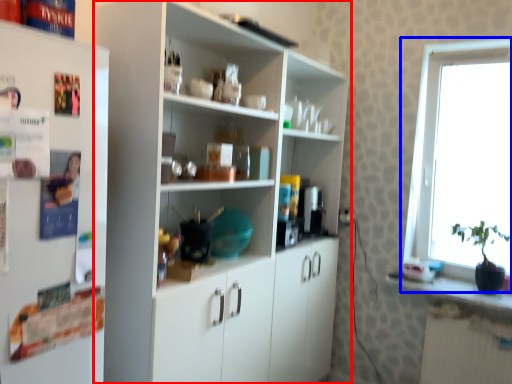
Question: Which object appears closest to the camera in this image, cupboard (highlighted by a red box) or window (highlighted by a blue box)?

Choices:
 (A) cupboard
 (B) window

Answer: (A)